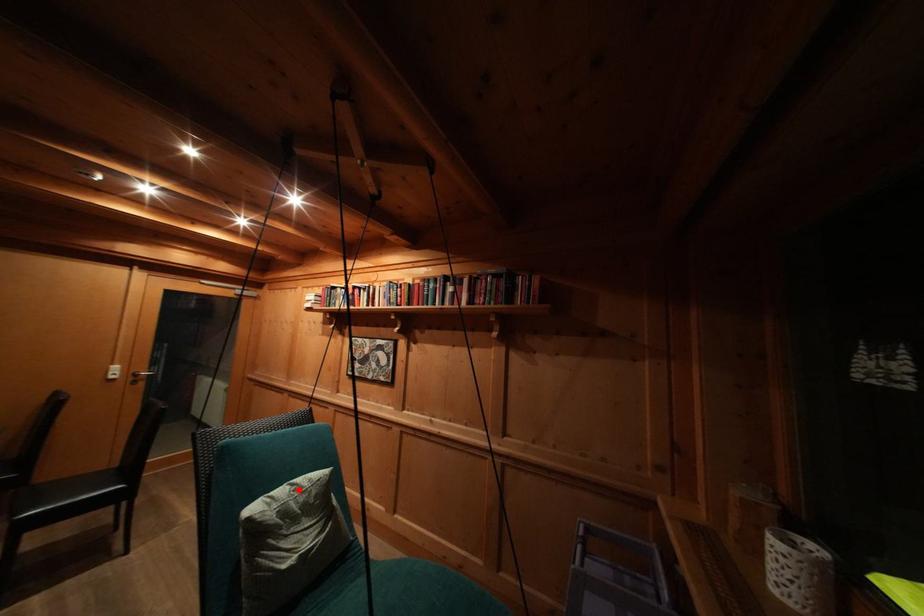
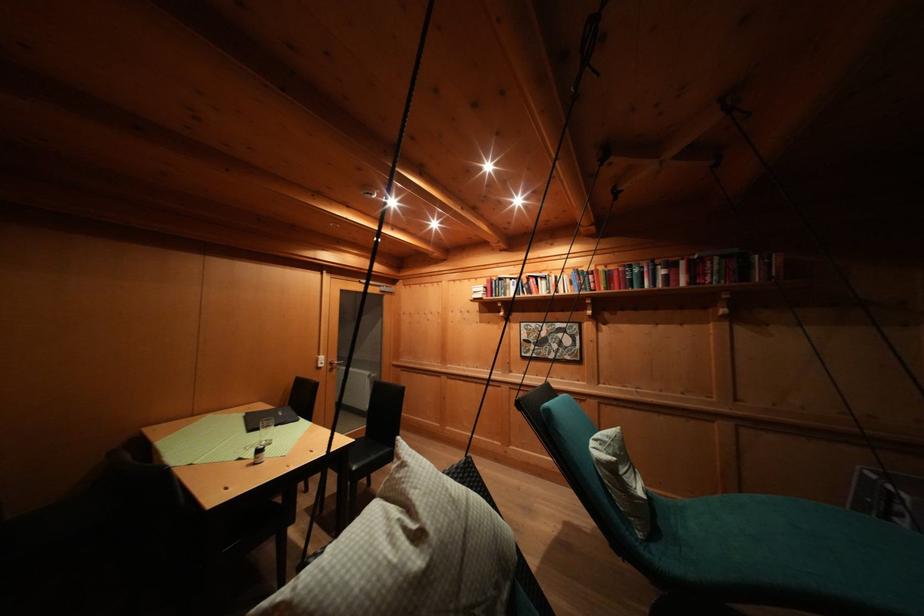
Find the pixel in the second image that matches the highlighted location in the first image.

(602, 445)